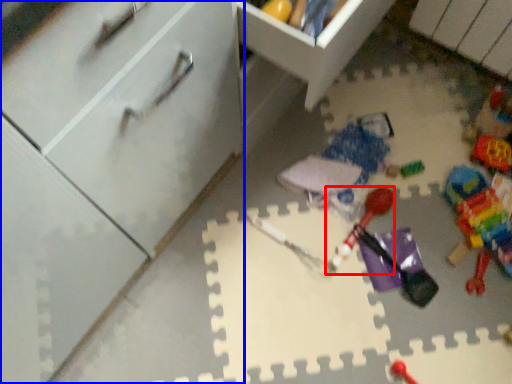
Question: Which point is further to the camera, toy (highlighted by a red box) or cabinetry (highlighted by a blue box)?

Choices:
 (A) toy
 (B) cabinetry

Answer: (A)